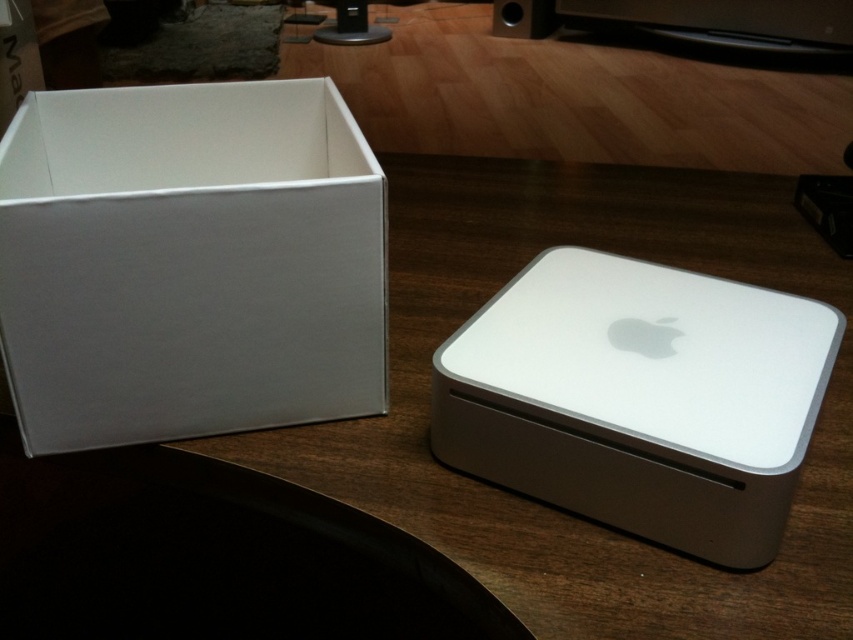
You are standing in front of a wooden desk with a white Apple product box and a silver Apple device. You want to reach the point at coordinates point (230,397). Can you estimate how far you need to move your hand to touch that point?

The point (230,397) is 22.80 inches away from the viewer, so you need to extend your hand about 22.80 inches to reach it.

You are setting up a new tech setup on the desk. You have a white matte apple mac mini at center and a matte black speaker at upper center. Which object should you place closer to the edge of the desk to ensure it doesn

The white matte apple mac mini at center might be wider than the matte black speaker at upper center, so placing the wider mac mini closer to the edge would allow it to fit better without overhanging the desk.

You are setting up a new tech setup on the desk. You need to place a new wireless charger that requires 10 cm of space around it. The wireless charger will be placed at point 0.411, 0.222. Is there enough space around the white cardboard box at upper left to place the charger?

The white cardboard box at upper left is located at point (189,262). Since the wireless charger requires 10 cm of space around it, and the box is exactly at that point, placing the charger there would mean the box is in the required space. Therefore, there is not enough space around the white cardboard box at upper left to place the charger without overlapping with the box itself.